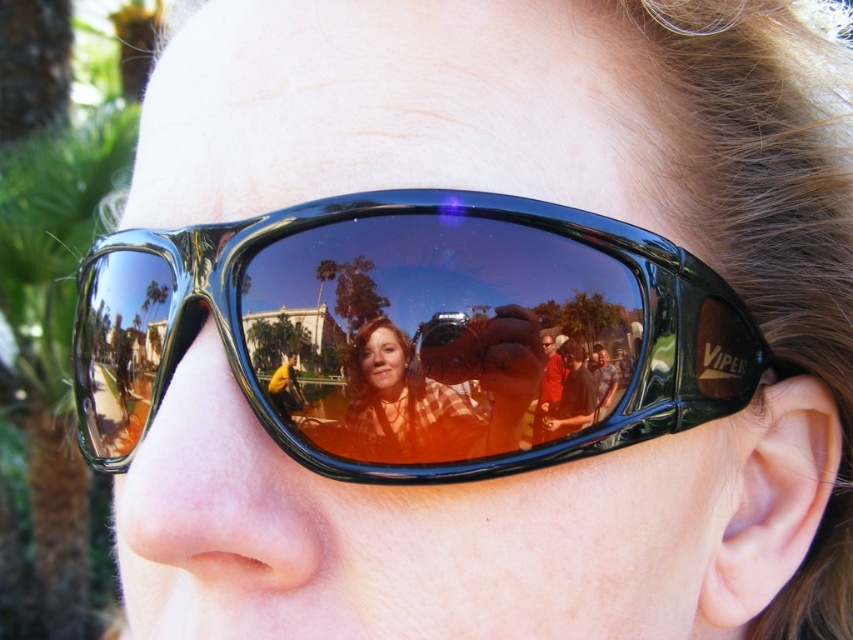
You are trying to decide which pair of sunglasses to wear for a sunny day. You have two options in the image, the shiny black goggles at center and the matte orange sunglasses at center. Based on their surface finishes, which one would be more suitable to reduce glare from the sun?

The shiny black goggles at center have a glossy finish, which can reflect more light, making them better at reducing glare compared to the matte orange sunglasses at center.

You are trying to decide which pair of sunglasses to wear for a sunny day. You have two options in the image, the shiny black goggles at center and the matte orange sunglasses at center. Based on their appearance, which one might be more suitable for reducing glare from the sun?

The shiny black goggles at center is located above matte orange sunglasses at center, but the matte orange sunglasses at center might be more suitable for reducing glare since matte finishes typically reflect less light compared to shiny surfaces.